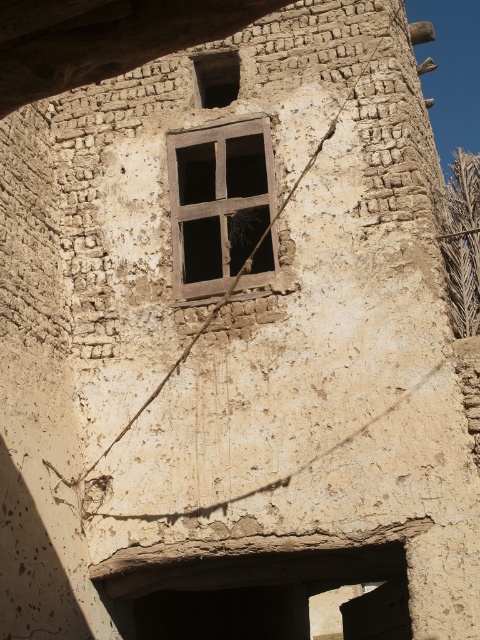
You are an architect inspecting an old building. You notice two windows in the wall. The wooden window at center and the brown textured stone window at upper center. Which window has a greater width?

The wooden window at center has a greater width than the brown textured stone window at upper center.

You are an architect inspecting an old building. You notice two windows in the wall. The wooden window at center and the brown textured stone window at upper center. Which window is taller?

The wooden window at center is taller than the brown textured stone window at upper center.